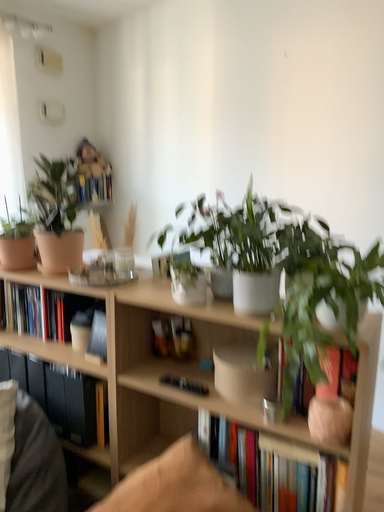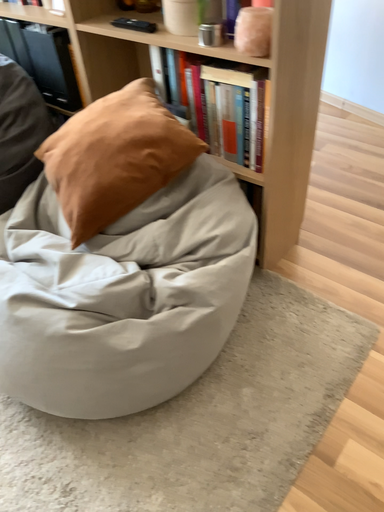
Question: How did the camera likely rotate when shooting the video?

Choices:
 (A) rotated upward
 (B) rotated downward

Answer: (B)